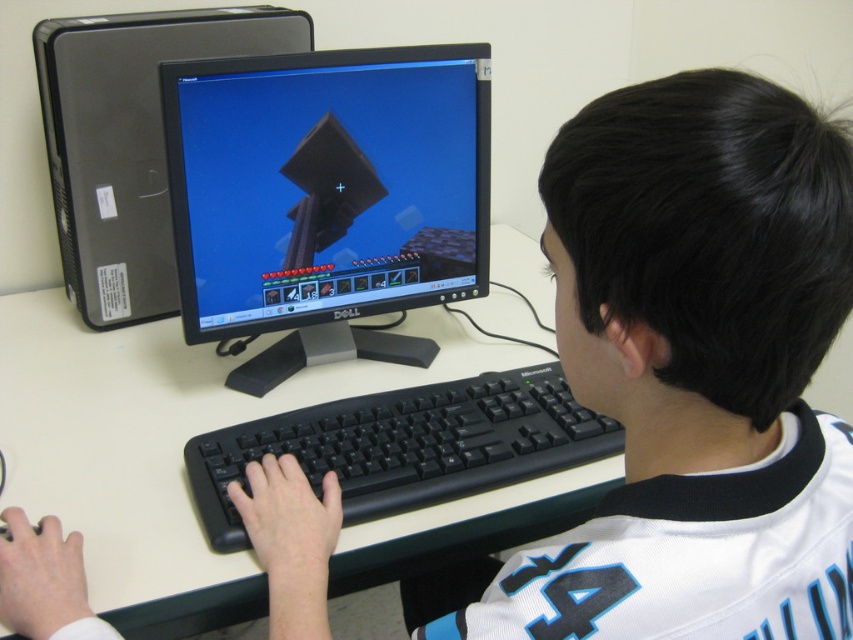
Question: From the image, what is the correct spatial relationship of matte black monitor at center in relation to black plastic keyboard at center?

Choices:
 (A) right
 (B) left

Answer: (B)

Question: Can you confirm if white plastic computer desk at center is positioned to the left of black plastic keyboard at center?

Choices:
 (A) yes
 (B) no

Answer: (A)

Question: Can you confirm if matte black monitor at center is positioned to the left of black plastic keyboard at center?

Choices:
 (A) yes
 (B) no

Answer: (A)

Question: Which is nearer to the matte black monitor at center?

Choices:
 (A) black plastic keyboard at center
 (B) white plastic computer desk at center

Answer: (B)

Question: Among these objects, which one is nearest to the camera?

Choices:
 (A) black plastic keyboard at center
 (B) white jersey at center
 (C) black plastic desktop at upper left
 (D) white plastic computer desk at center

Answer: (B)

Question: Which of the following is the farthest from the observer?

Choices:
 (A) black plastic keyboard at center
 (B) matte black monitor at center
 (C) white plastic computer desk at center

Answer: (B)